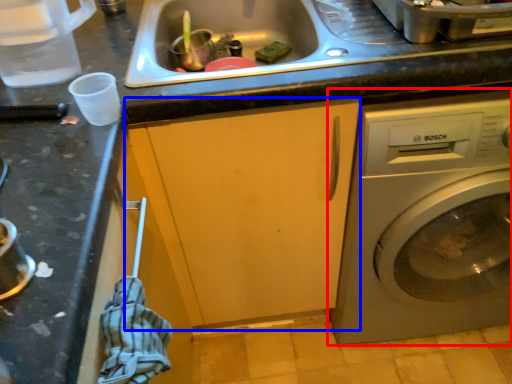
Question: Which of the following is the farthest to the observer, washing machine (highlighted by a red box) or cabinetry (highlighted by a blue box)?

Choices:
 (A) washing machine
 (B) cabinetry

Answer: (B)